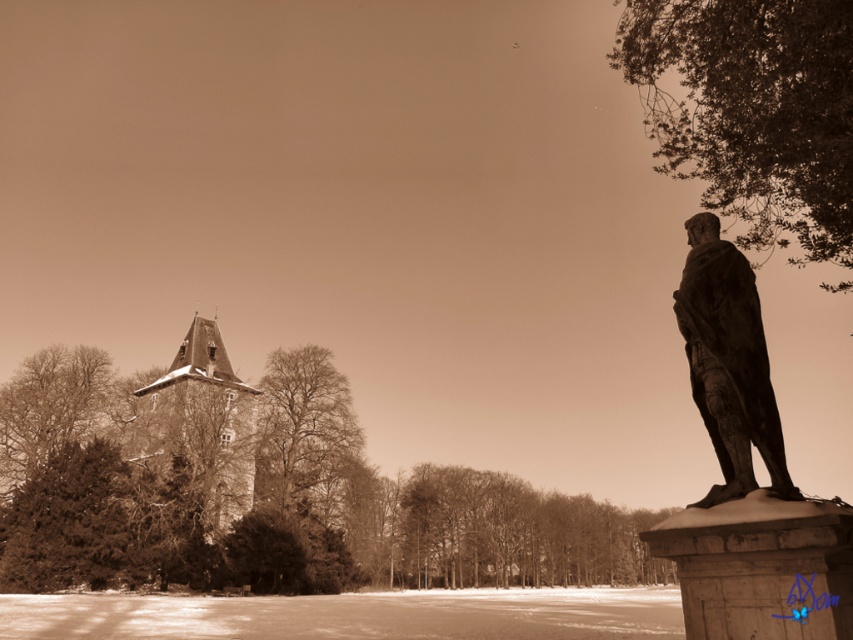
Is bronze statue at right shorter than smooth stone spire at center-left?

Correct, bronze statue at right is not as tall as smooth stone spire at center-left.

Measure the distance between point (x=773, y=413) and camera.

Point (x=773, y=413) is 21.68 feet away from camera.

Which is behind, point (756, 397) or point (206, 435)?

Positioned behind is point (206, 435).

This screenshot has width=853, height=640. Find the location of `bronze statue at right`. bronze statue at right is located at coordinates (728, 362).